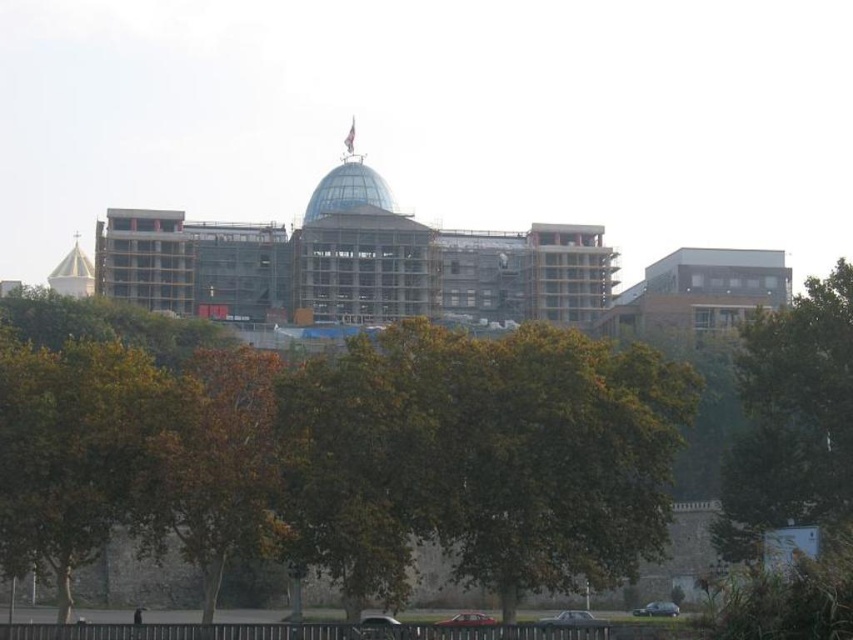
You are standing at the center of the construction site and see the point marked at coordinates (791, 419). What object is located at that point?

The point at coordinates (791, 419) is occupied by a green leafy tree at right.

You are standing in front of the construction site and see the green leafy tree at lower left and the green leafy tree at right. Which tree is positioned more to the east if the construction site faces north?

The green leafy tree at lower left is positioned more to the east because it is to the left of the green leafy tree at right, and since the construction site faces north, left would correspond to the east direction.

You are standing in front of the construction site and want to determine the relative positions of two points marked in the image. Which of the two points, point (161, 522) or point (796, 371), is closer to you?

Point (161, 522) is closer to the viewer than point (796, 371).